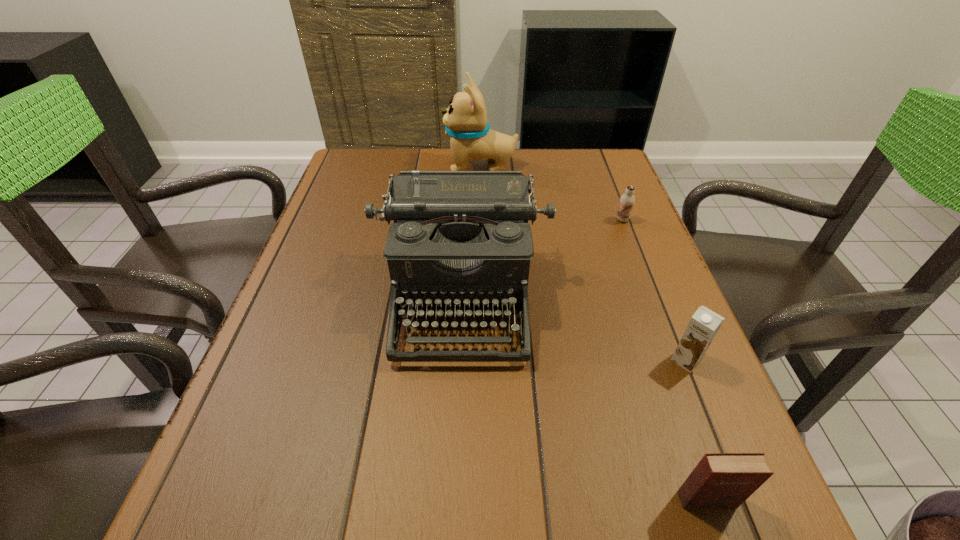
Where is `blank region between the shortest object and the typewriter`? This screenshot has width=960, height=540. blank region between the shortest object and the typewriter is located at coordinates (542, 259).

I want to click on object that stands as the fourth closest to the puppy, so click(x=720, y=480).

Where is `the closest object to the puppy`? The height and width of the screenshot is (540, 960). the closest object to the puppy is located at coordinates (459, 237).

The width and height of the screenshot is (960, 540). Identify the location of free space that satisfies the following two spatial constraints: 1. on the typing side of the typewriter; 2. on the left side of the taller chocolate milk. (459, 360).

The height and width of the screenshot is (540, 960). What are the coordinates of `free point that satisfies the following two spatial constraints: 1. on the face of the farthest object; 2. on the typing side of the typewriter` in the screenshot? It's located at (481, 298).

Where is `vacant region that satisfies the following two spatial constraints: 1. on the face of the farther chocolate milk; 2. on the right side of the puppy`? The width and height of the screenshot is (960, 540). vacant region that satisfies the following two spatial constraints: 1. on the face of the farther chocolate milk; 2. on the right side of the puppy is located at coordinates (481, 220).

Where is `vacant region that satisfies the following two spatial constraints: 1. on the face of the farthest object; 2. on the typing side of the typewriter`? The image size is (960, 540). vacant region that satisfies the following two spatial constraints: 1. on the face of the farthest object; 2. on the typing side of the typewriter is located at coordinates (481, 298).

This screenshot has height=540, width=960. What are the coordinates of `vacant position in the image that satisfies the following two spatial constraints: 1. on the back side of the nearer chocolate milk; 2. on the face of the puppy` in the screenshot? It's located at (608, 166).

The height and width of the screenshot is (540, 960). I want to click on vacant area in the image that satisfies the following two spatial constraints: 1. on the face of the farthest object; 2. on the left side of the farther chocolate milk, so [x=481, y=220].

Find the location of a particular element. The width and height of the screenshot is (960, 540). vacant area in the image that satisfies the following two spatial constraints: 1. on the typing side of the taller chocolate milk; 2. on the left side of the second tallest object is located at coordinates (459, 360).